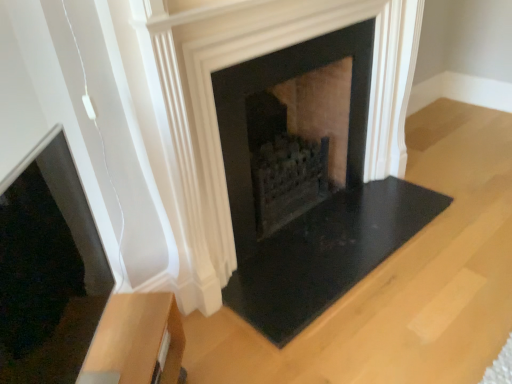
Locate an element on the screen. This screenshot has height=384, width=512. free point above light brown wood side table at lower left (from a real-world perspective) is located at coordinates (119, 334).